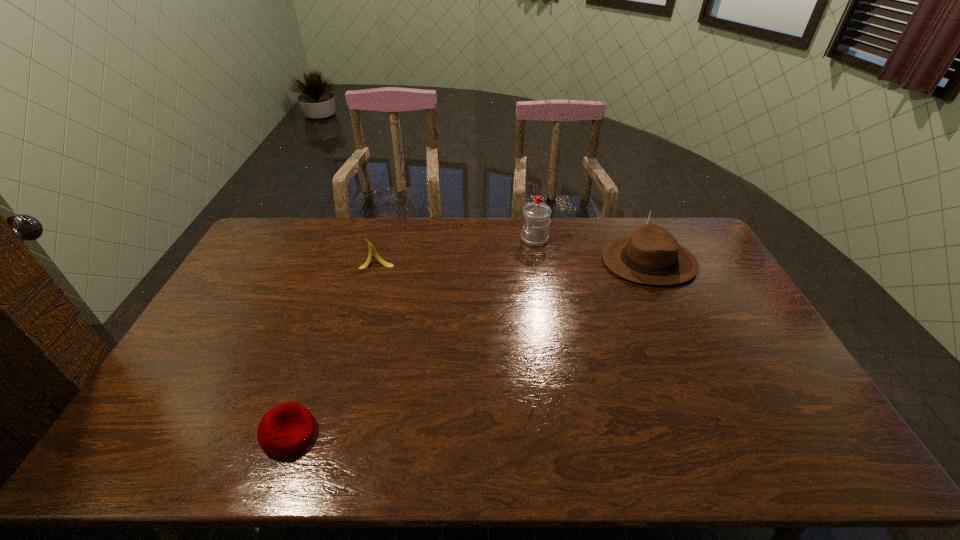
You are a GUI agent. You are given a task and a screenshot of the screen. Output one action in this format:
    pyautogui.click(x=<x>, y=<y>)
    Task: Click on the vacant space located 0.340m on the feather side of the third shortest object
    This screenshot has height=540, width=960.
    Given the screenshot: What is the action you would take?
    pyautogui.click(x=507, y=261)

Where is `vacant space located 0.390m on the feather side of the third shortest object`? vacant space located 0.390m on the feather side of the third shortest object is located at coordinates (492, 261).

Identify the location of vacant space located on the feather side of the third shortest object. (518, 261).

Identify the location of vacant space located 0.290m on the left of the banana. (278, 260).

Locate an element on the screen. This screenshot has height=540, width=960. vacant region located 0.280m on the seat area of the nearest object is located at coordinates (431, 434).

Locate an element on the screen. The height and width of the screenshot is (540, 960). water bottle that is at the far edge is located at coordinates (536, 214).

This screenshot has height=540, width=960. Find the location of `fedora present at the far edge`. fedora present at the far edge is located at coordinates (651, 255).

At what (x,y) coordinates should I click in order to perform the action: click on banana that is at the far edge. Please return your answer as a coordinate pair (x, y). Image resolution: width=960 pixels, height=540 pixels. Looking at the image, I should click on (372, 251).

Locate an element on the screen. object present at the near edge is located at coordinates (286, 429).

The width and height of the screenshot is (960, 540). I want to click on object located in the right edge section of the desktop, so click(651, 255).